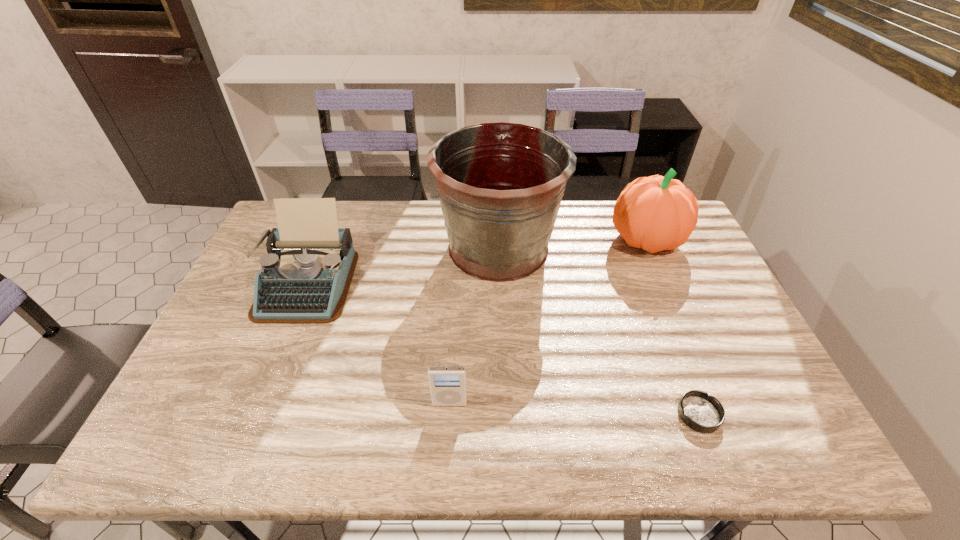
Find the location of a particular element. This screenshot has width=960, height=540. vacant point that satisfies the following two spatial constraints: 1. on the front-facing side of the ashtray; 2. on the left side of the iPod is located at coordinates (449, 414).

The height and width of the screenshot is (540, 960). I want to click on free space that satisfies the following two spatial constraints: 1. on the front-facing side of the iPod; 2. on the left side of the shortest object, so click(x=449, y=414).

At what (x,y) coordinates should I click in order to perform the action: click on free region that satisfies the following two spatial constraints: 1. on the back side of the ashtray; 2. on the left side of the fourth shortest object. Please return your answer as a coordinate pair (x, y). Looking at the image, I should click on (631, 239).